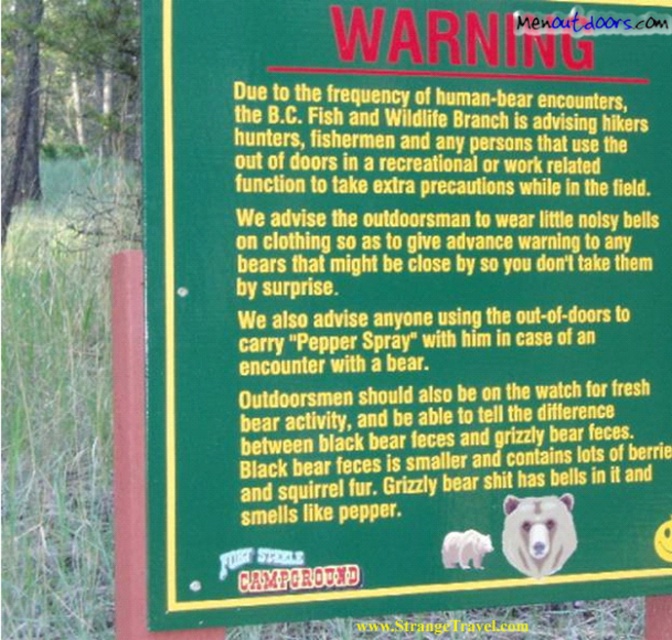
Question: Which object is farther from the camera taking this photo?

Choices:
 (A) brown furry bear at center
 (B) white fur bear at lower center

Answer: (A)

Question: Does brown furry bear at center appear under white fur bear at lower center?

Choices:
 (A) yes
 (B) no

Answer: (B)

Question: Is brown furry bear at center positioned behind white fur bear at lower center?

Choices:
 (A) no
 (B) yes

Answer: (B)

Question: Does brown furry bear at center appear over white fur bear at lower center?

Choices:
 (A) yes
 (B) no

Answer: (A)

Question: Among these objects, which one is farthest from the camera?

Choices:
 (A) white fur bear at lower center
 (B) brown furry bear at center

Answer: (B)

Question: Which point is closer to the camera taking this photo?

Choices:
 (A) (562, 531)
 (B) (489, 550)

Answer: (B)